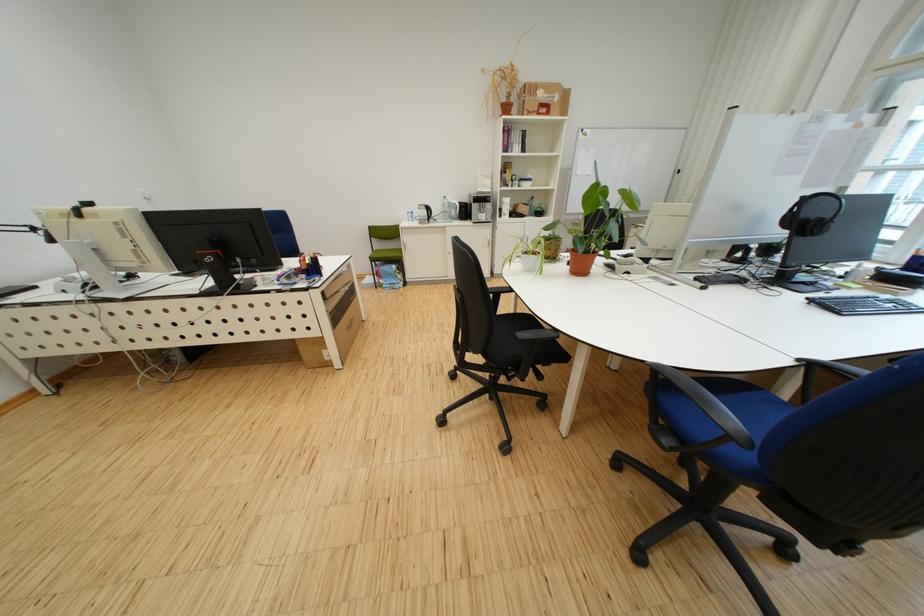
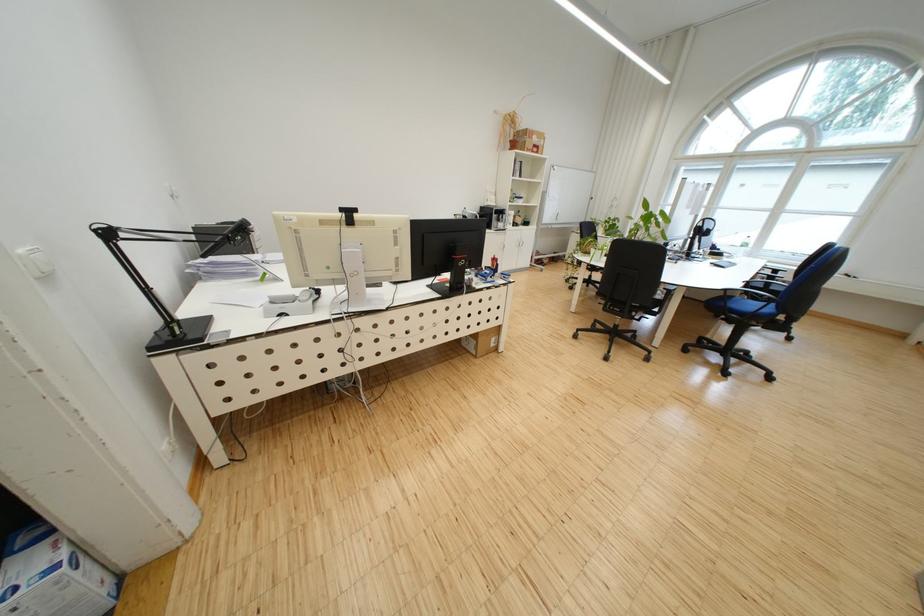
Question: I am providing you with two images of the same scene from different viewpoints. Which of the following objects are not visible in image2?

Choices:
 (A) keyboard
 (B) black headset
 (C) blue and white box
 (D) black computer mouse

Answer: (D)